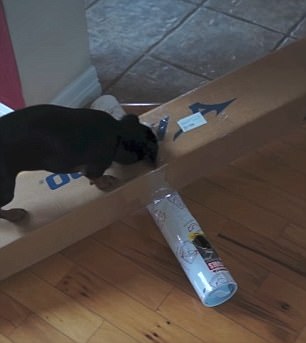
You are a GUI agent. You are given a task and a screenshot of the screen. Output one action in this format:
    pyautogui.click(x=<x>, y=<y>)
    Task: Click on the wood flooring
    The width and height of the screenshot is (306, 343).
    Given the screenshot: What is the action you would take?
    pyautogui.click(x=119, y=267)